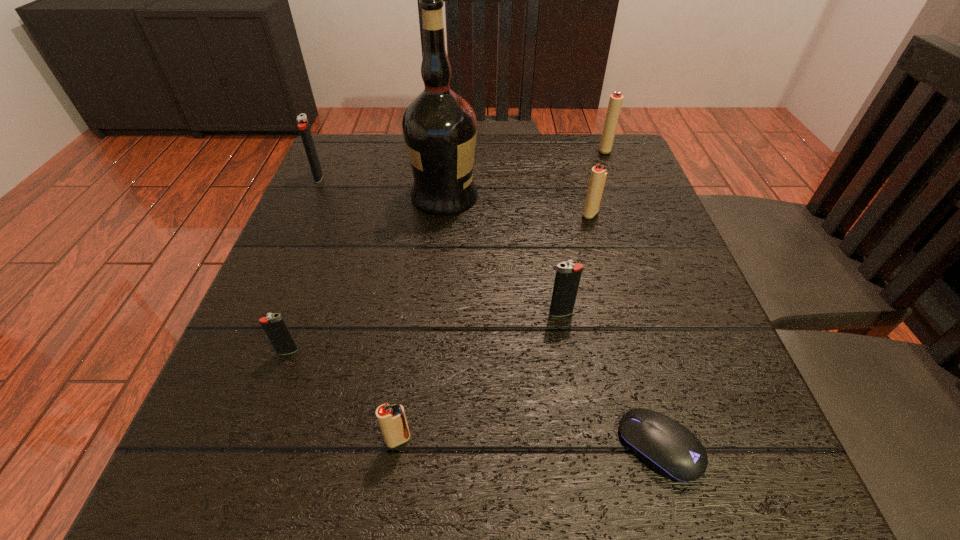
Where is `the nearest red igniter`? This screenshot has height=540, width=960. the nearest red igniter is located at coordinates (392, 419).

Where is `the second nearest igniter`? the second nearest igniter is located at coordinates (274, 326).

You are a GUI agent. You are given a task and a screenshot of the screen. Output one action in this format:
    pyautogui.click(x=<x>, y=<y>)
    Task: Click on the nearest black igniter
    This screenshot has width=960, height=540.
    Given the screenshot: What is the action you would take?
    pyautogui.click(x=274, y=326)

Where is `black computer mouse`? The width and height of the screenshot is (960, 540). black computer mouse is located at coordinates (669, 448).

The width and height of the screenshot is (960, 540). What are the coordinates of `the shortest object` in the screenshot? It's located at (669, 448).

Where is `vacant position located 0.290m on the surface of the liquor`? vacant position located 0.290m on the surface of the liquor is located at coordinates (609, 195).

This screenshot has height=540, width=960. In order to click on vacant space located 0.110m on the left of the rightmost igniter in this screenshot , I will do `click(555, 150)`.

Where is `free spot located on the front of the leftmost igniter`? This screenshot has width=960, height=540. free spot located on the front of the leftmost igniter is located at coordinates (297, 225).

Where is `free space located 0.100m on the right of the second smallest black igniter`? free space located 0.100m on the right of the second smallest black igniter is located at coordinates (633, 313).

Where is `free space located 0.060m on the left of the fourth nearest igniter`? free space located 0.060m on the left of the fourth nearest igniter is located at coordinates (554, 214).